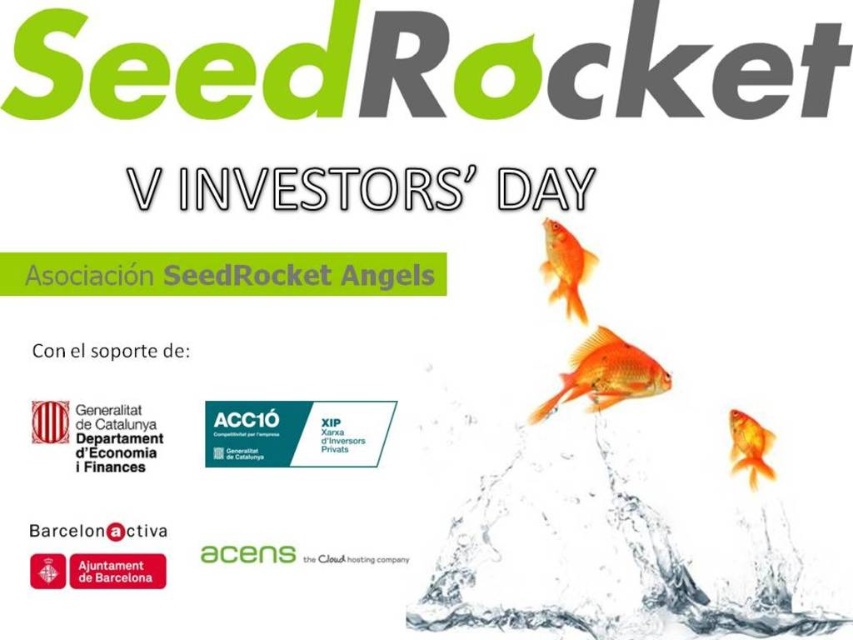
You are a graphic designer working on the SeedRocket V Investors Day promotional poster. You need to ensure that the two orange fish at upper right are spaced at least 3 inches apart for clarity. Based on the provided image, will the current spacing between the glossy orange fish at upper right and the shiny orange fish at upper right meet this requirement?

The distance between the glossy orange fish at upper right and the shiny orange fish at upper right is 2.87 inches, which is less than the required 3 inches. Therefore, the spacing does not meet the requirement and needs adjustment.

You are an event planner reviewing the promotional graphic for SeedRocket V Investors Day. You need to ensure that both the transparent liquid water at center and the glossy orange fish at upper right are clearly visible. Given their relative sizes, which object might be more noticeable to attendees?

The transparent liquid water at center is larger in size than the glossy orange fish at upper right, so the transparent liquid water at center would be more noticeable to attendees.